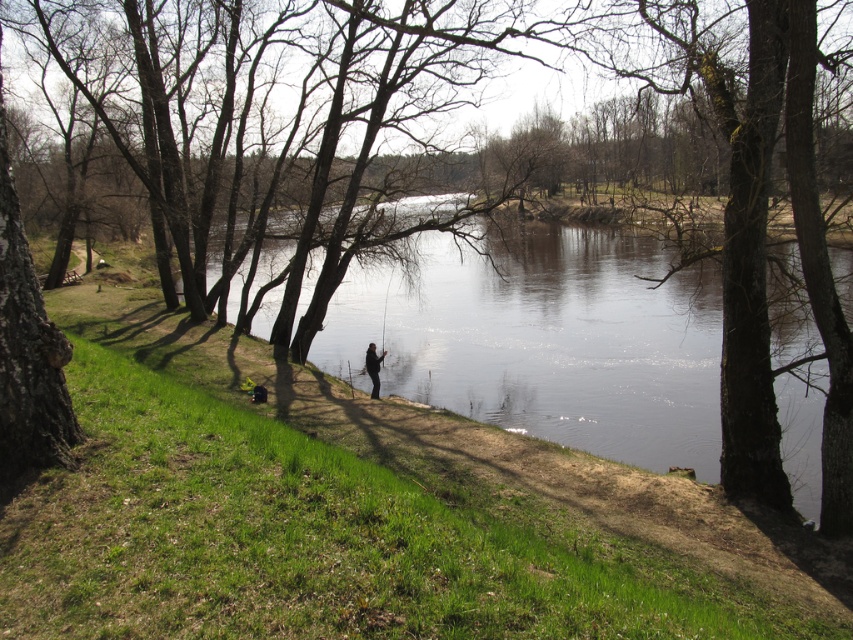
Question: Which object appears closest to the camera in this image?

Choices:
 (A) dark gray jacket at center
 (B) clear water at center

Answer: (B)

Question: Can you confirm if clear water at center is smaller than dark gray jacket at center?

Choices:
 (A) yes
 (B) no

Answer: (B)

Question: Can you confirm if clear water at center is positioned above dark gray jacket at center?

Choices:
 (A) yes
 (B) no

Answer: (A)

Question: Can you confirm if clear water at center is thinner than dark gray jacket at center?

Choices:
 (A) yes
 (B) no

Answer: (B)